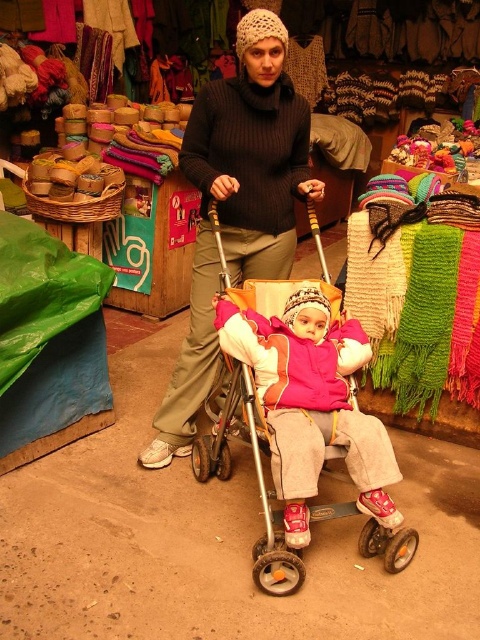
You are standing in the market and want to reach a display of handcrafted scarves located at point [248,230]. If your height is 5 feet 6 inches, will you be able to comfortably reach the display?

The display at point [248,230] is 7.50 feet away from you. Since the distance is greater than your height of 5 feet 6 inches, you would need to take a step forward or use a tool to reach it comfortably.

You are a customer in the market and want to buy a hat for your child. You see the knitted woolen hat at center and the pink fleece jacket at center. Which item is positioned higher on the child?

The knitted woolen hat at center is above the pink fleece jacket at center, so it is positioned higher on the child.

In the scene shown: You are a customer in the market looking to purchase a knitted item. You notice the knitted woolen hat at center and the pink fleece jacket at center. Which item has a greater width?

The knitted woolen hat at center has a greater width than the pink fleece jacket at center.